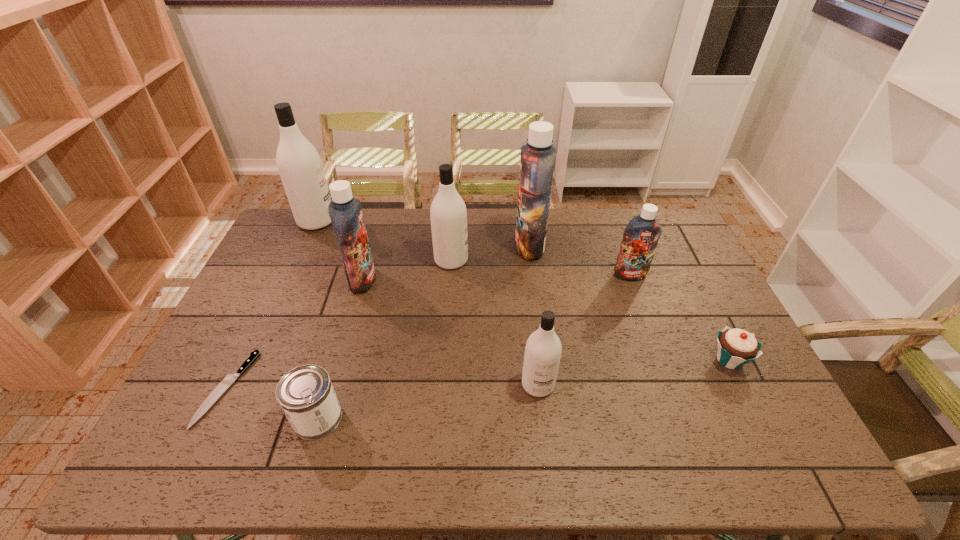
You are a GUI agent. You are given a task and a screenshot of the screen. Output one action in this format:
    pyautogui.click(x=<x>, y=<y>)
    Task: Click on the farthest white shampoo
    Image resolution: width=960 pixels, height=540 pixels.
    Given the screenshot: What is the action you would take?
    click(299, 164)

You are a GUI agent. You are given a task and a screenshot of the screen. Output one action in this format:
    pyautogui.click(x=<x>, y=<y>)
    Task: Click on the biggest white shampoo
    The width and height of the screenshot is (960, 540).
    Given the screenshot: What is the action you would take?
    pyautogui.click(x=299, y=164)

This screenshot has width=960, height=540. Identify the location of the biggest blue shampoo. (537, 163).

Identify the location of the farthest blue shampoo. This screenshot has height=540, width=960. point(537,163).

I want to click on the second biggest blue shampoo, so click(x=345, y=211).

At what (x,y) coordinates should I click in order to perform the action: click on the second shampoo from left to right. Please return your answer as a coordinate pair (x, y). Image resolution: width=960 pixels, height=540 pixels. Looking at the image, I should click on (345, 211).

I want to click on the fifth object from left to right, so click(x=448, y=213).

Where is `the second nearest white shampoo`? This screenshot has width=960, height=540. the second nearest white shampoo is located at coordinates (448, 213).

Where is `the smallest blue shampoo`? The width and height of the screenshot is (960, 540). the smallest blue shampoo is located at coordinates (640, 238).

Find the location of a particular element. the rightmost shampoo is located at coordinates (640, 238).